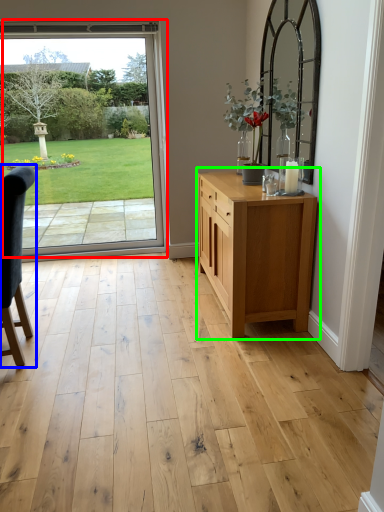
Question: Which is nearer to the door (highlighted by a red box)? chair (highlighted by a blue box) or chest of drawers (highlighted by a green box).

Choices:
 (A) chair
 (B) chest of drawers

Answer: (B)